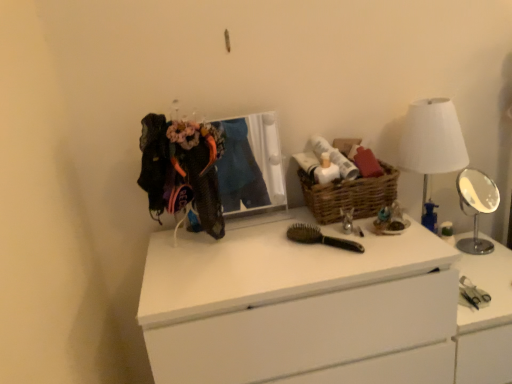
Question: Relative to woven brown basket at center, is white fabric lampshade at right in front or behind?

Choices:
 (A) behind
 (B) front

Answer: (B)

Question: Considering the positions of point (455, 162) and point (376, 198), is point (455, 162) closer or farther from the camera than point (376, 198)?

Choices:
 (A) farther
 (B) closer

Answer: (A)

Question: Which object is positioned farthest from the white plastic vanity at right?

Choices:
 (A) knitted fabric clothesline at upper left
 (B) woven brown basket at center
 (C) silver metallic mirror at right
 (D) black wooden hairbrush at center
 (E) white matte chest of drawers at center

Answer: (A)

Question: Which object is positioned closest to the knitted fabric clothesline at upper left?

Choices:
 (A) silver metallic mirror at right
 (B) white plastic vanity at right
 (C) white matte chest of drawers at center
 (D) woven brown basket at center
 (E) white fabric lampshade at right

Answer: (C)